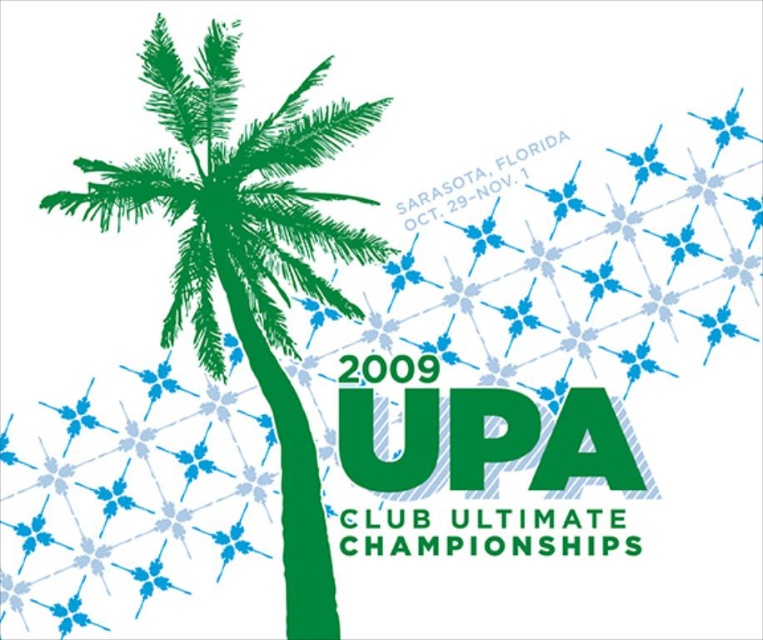
Between point (295, 97) and point (407, 474), which one is positioned behind?

Positioned behind is point (407, 474).

Who is more forward, (211, 188) or (557, 451)?

Point (211, 188) is in front.

Where is `green ink palm tree at left`? green ink palm tree at left is located at coordinates (246, 256).